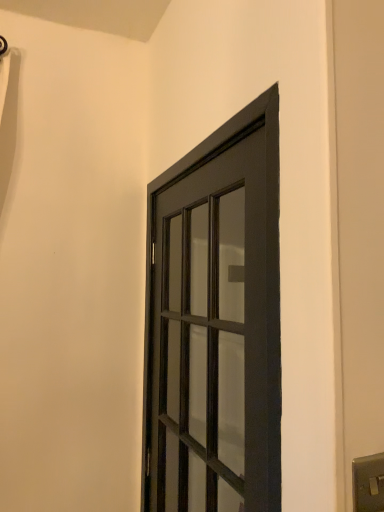
At what (x,y) coordinates should I click in order to perform the action: click on satin silver switch at lower right. Please return your answer as a coordinate pair (x, y). The height and width of the screenshot is (512, 384). Looking at the image, I should click on tap(368, 483).

The width and height of the screenshot is (384, 512). What do you see at coordinates (368, 483) in the screenshot? I see `satin silver switch at lower right` at bounding box center [368, 483].

The image size is (384, 512). What do you see at coordinates (215, 325) in the screenshot? I see `matte black door at center` at bounding box center [215, 325].

Where is `matte black door at center`? matte black door at center is located at coordinates (215, 325).

Where is `satin silver switch at lower right`? The width and height of the screenshot is (384, 512). satin silver switch at lower right is located at coordinates (368, 483).

Is matte black door at center to the left or to the right of satin silver switch at lower right in the image?

In the image, matte black door at center appears on the left side of satin silver switch at lower right.

Which is in front, matte black door at center or satin silver switch at lower right?

Positioned in front is satin silver switch at lower right.

Which is closer, (249,252) or (359,479)?

The point (359,479) is in front.

From the image's perspective, is matte black door at center beneath satin silver switch at lower right?

Incorrect, from the image's perspective, matte black door at center is higher than satin silver switch at lower right.

From a real-world perspective, is matte black door at center positioned under satin silver switch at lower right based on gravity?

Incorrect, from a real-world perspective, matte black door at center is higher than satin silver switch at lower right.

In the scene shown: Is matte black door at center wider than satin silver switch at lower right?

Yes.

In the scene shown: Can you confirm if matte black door at center is taller than satin silver switch at lower right?

Indeed, matte black door at center has a greater height compared to satin silver switch at lower right.

Does matte black door at center have a larger size compared to satin silver switch at lower right?

Yes.

Is matte black door at center situated inside satin silver switch at lower right or outside?

matte black door at center cannot be found inside satin silver switch at lower right.

Is matte black door at center placed right next to satin silver switch at lower right?

No, matte black door at center is not next to satin silver switch at lower right.

Could you tell me if matte black door at center is facing satin silver switch at lower right?

No, matte black door at center is not aimed at satin silver switch at lower right.

How different are the orientations of matte black door at center and satin silver switch at lower right in degrees?

90 degrees.

Measure the distance from matte black door at center to satin silver switch at lower right.

matte black door at center and satin silver switch at lower right are 29.36 inches apart.

Where is `door above the satin silver switch at lower right (from the image's perspective)`? This screenshot has width=384, height=512. door above the satin silver switch at lower right (from the image's perspective) is located at coordinates (215, 325).

Which object is positioned more to the right, satin silver switch at lower right or matte black door at center?

satin silver switch at lower right is more to the right.

Does satin silver switch at lower right lie behind matte black door at center?

No, it is in front of matte black door at center.

Considering the points (353, 494) and (174, 451), which point is behind, point (353, 494) or point (174, 451)?

The point (174, 451) is more distant.

From the image's perspective, which one is positioned lower, satin silver switch at lower right or matte black door at center?

satin silver switch at lower right appears lower in the image.

From a real-world perspective, between satin silver switch at lower right and matte black door at center, who is vertically lower?

From a 3D spatial view, satin silver switch at lower right is below.

In terms of width, does satin silver switch at lower right look wider or thinner when compared to matte black door at center?

satin silver switch at lower right is thinner than matte black door at center.

Considering the sizes of objects satin silver switch at lower right and matte black door at center in the image provided, who is taller, satin silver switch at lower right or matte black door at center?

matte black door at center.

Who is smaller, satin silver switch at lower right or matte black door at center?

Smaller between the two is satin silver switch at lower right.

Is matte black door at center located within satin silver switch at lower right?

No, matte black door at center is not a part of satin silver switch at lower right.

Are satin silver switch at lower right and matte black door at center making contact?

No, satin silver switch at lower right is not beside matte black door at center.

Is satin silver switch at lower right oriented away from matte black door at center?

Yes.

Where is `door that appears behind the satin silver switch at lower right`? This screenshot has height=512, width=384. door that appears behind the satin silver switch at lower right is located at coordinates (215, 325).

The height and width of the screenshot is (512, 384). Find the location of `door behind the satin silver switch at lower right`. door behind the satin silver switch at lower right is located at coordinates (215, 325).

Where is `light switch in front of the matte black door at center`? This screenshot has width=384, height=512. light switch in front of the matte black door at center is located at coordinates (368, 483).